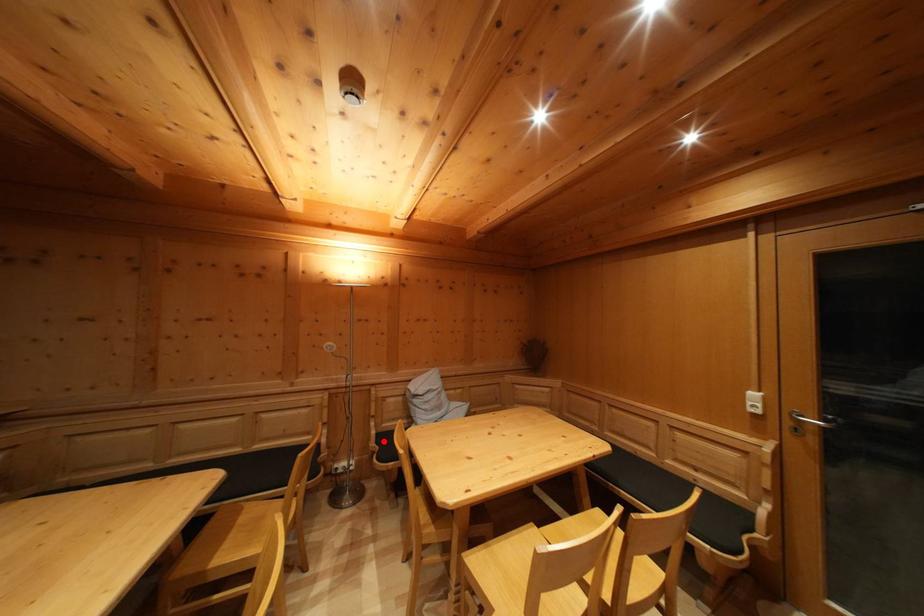
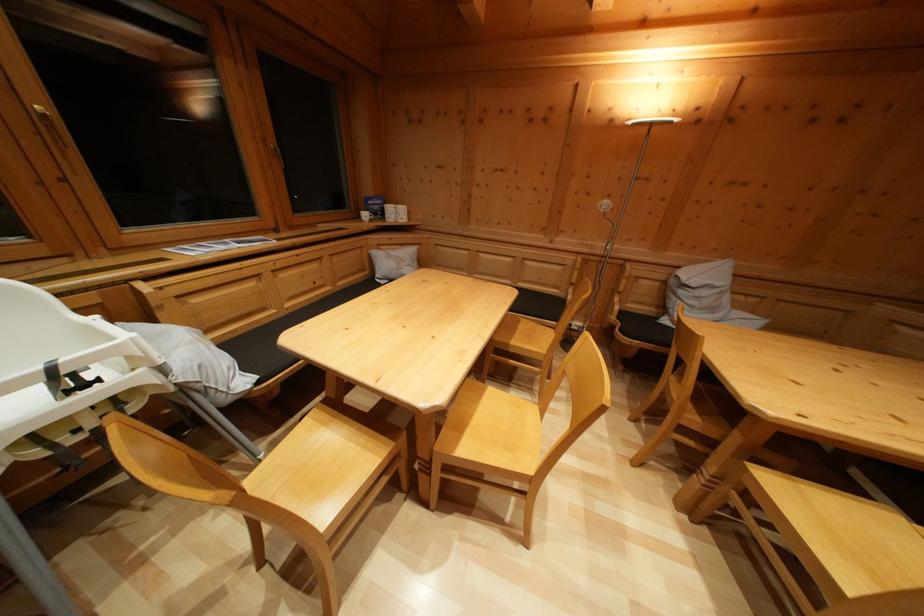
Question: A red point is marked in image1. In image2, is the corresponding 3D point closer to the camera or farther? Reply with the corresponding letter.

Choices:
 (A) The corresponding 3D point is closer.
 (B) The corresponding 3D point is farther.

Answer: (A)